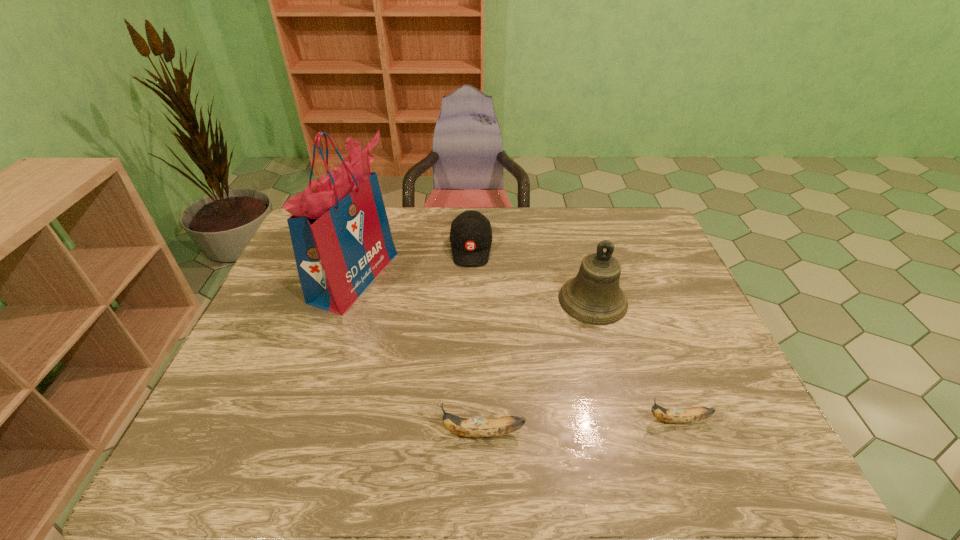
I want to click on the tallest object, so point(340,233).

This screenshot has width=960, height=540. I want to click on grocery bag, so click(340, 233).

Find the location of a particular element. The image size is (960, 540). bell is located at coordinates (594, 297).

The width and height of the screenshot is (960, 540). Find the location of `baseball cap`. baseball cap is located at coordinates (471, 234).

This screenshot has height=540, width=960. What are the coordinates of `the taller banana` in the screenshot? It's located at (467, 427).

You are a GUI agent. You are given a task and a screenshot of the screen. Output one action in this format:
    pyautogui.click(x=<x>, y=<y>)
    Task: Click on the shorter banana
    This screenshot has width=960, height=540.
    Given the screenshot: What is the action you would take?
    pyautogui.click(x=695, y=414)

The height and width of the screenshot is (540, 960). I want to click on the right banana, so click(695, 414).

You are a GUI agent. You are given a task and a screenshot of the screen. Output one action in this format:
    pyautogui.click(x=<x>, y=<y>)
    Task: Click on the vacant space positioned 0.350m on the front-facing side of the leftmost object
    This screenshot has width=960, height=540.
    Given the screenshot: What is the action you would take?
    pyautogui.click(x=509, y=276)

Image resolution: width=960 pixels, height=540 pixels. I want to click on vacant space located 0.370m on the left of the bell, so click(x=428, y=300).

Identify the location of free space located 0.350m with a logo on the front of the baseball cap. (468, 359).